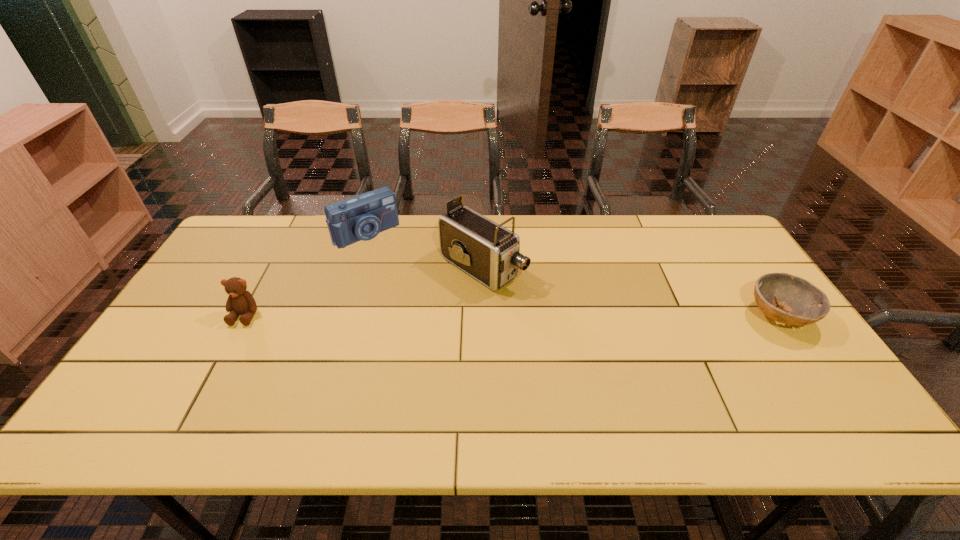
Locate an element on the screen. teddy bear is located at coordinates (240, 301).

What are the coordinates of `the leftmost object` in the screenshot? It's located at (240, 301).

Identify the location of bowl. (802, 303).

You are a GUI agent. You are given a task and a screenshot of the screen. Output one action in this format:
    pyautogui.click(x=<x>, y=<y>)
    Task: Click on the rightmost object
    This screenshot has height=540, width=960.
    Given the screenshot: What is the action you would take?
    pyautogui.click(x=802, y=303)

Where is `the tallest object`? This screenshot has width=960, height=540. the tallest object is located at coordinates click(490, 253).

Identify the location of the second object from right to left. The height and width of the screenshot is (540, 960). (490, 253).

Image resolution: width=960 pixels, height=540 pixels. Find the location of `camera`. camera is located at coordinates (362, 217).

Locate an element on the screen. The width and height of the screenshot is (960, 540). vacant area located 0.230m on the face of the second shortest object is located at coordinates (199, 402).

Locate an element on the screen. This screenshot has width=960, height=540. vacant point located 0.080m on the front of the shortest object is located at coordinates (812, 366).

I want to click on vacant space situated 0.280m at the lens of the second object from right to left, so click(595, 336).